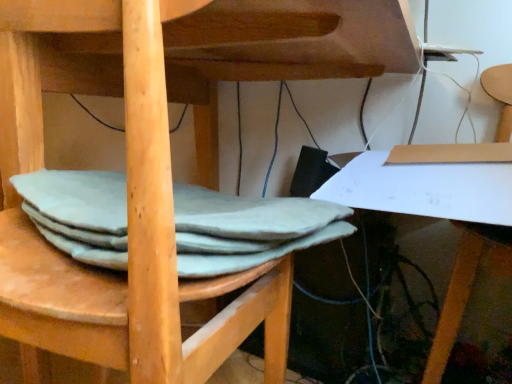
Question: Does light gray felt at lower left contain matte cardboard chair at lower right?

Choices:
 (A) yes
 (B) no

Answer: (B)

Question: Considering the relative positions of light gray felt at lower left and matte cardboard chair at lower right in the image provided, is light gray felt at lower left to the left of matte cardboard chair at lower right from the viewer's perspective?

Choices:
 (A) no
 (B) yes

Answer: (B)

Question: Does light gray felt at lower left have a lesser width compared to matte cardboard chair at lower right?

Choices:
 (A) no
 (B) yes

Answer: (B)

Question: Is the position of light gray felt at lower left more distant than that of matte cardboard chair at lower right?

Choices:
 (A) no
 (B) yes

Answer: (A)

Question: From a real-world perspective, is light gray felt at lower left located higher than matte cardboard chair at lower right?

Choices:
 (A) no
 (B) yes

Answer: (B)

Question: Is light gray felt at lower left shorter than matte cardboard chair at lower right?

Choices:
 (A) no
 (B) yes

Answer: (B)

Question: Is matte cardboard chair at lower right positioned beyond the bounds of light gray felt at lower left?

Choices:
 (A) no
 (B) yes

Answer: (B)

Question: From the image's perspective, is matte cardboard chair at lower right below light gray felt at lower left?

Choices:
 (A) yes
 (B) no

Answer: (A)

Question: Does matte cardboard chair at lower right turn towards light gray felt at lower left?

Choices:
 (A) yes
 (B) no

Answer: (B)

Question: Is light gray felt at lower left at the back of matte cardboard chair at lower right?

Choices:
 (A) yes
 (B) no

Answer: (B)

Question: Is matte cardboard chair at lower right in contact with light gray felt at lower left?

Choices:
 (A) no
 (B) yes

Answer: (A)

Question: Can you confirm if matte cardboard chair at lower right is positioned to the right of light gray felt at lower left?

Choices:
 (A) yes
 (B) no

Answer: (A)

Question: From the image's perspective, is matte cardboard chair at lower right positioned above or below light gray felt at lower left?

Choices:
 (A) above
 (B) below

Answer: (B)